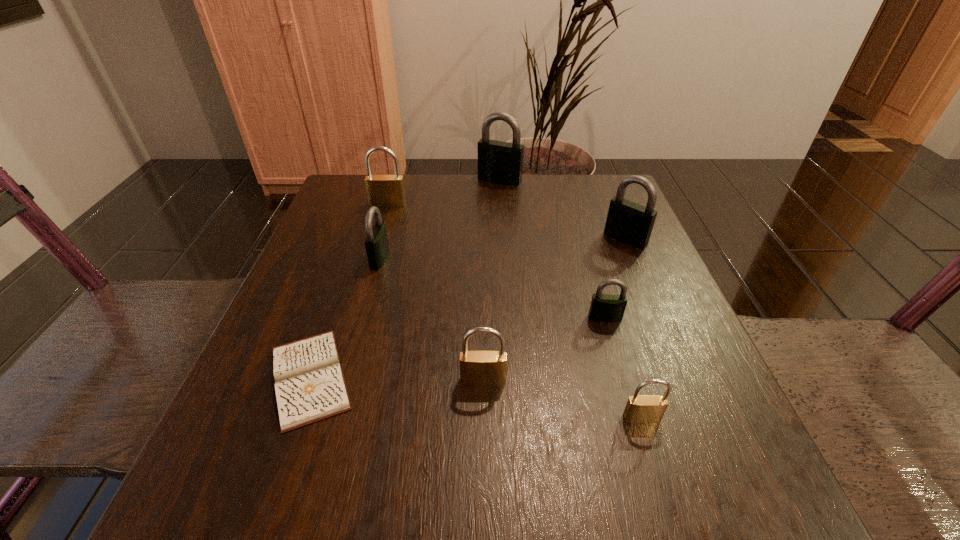
You are a GUI agent. You are given a task and a screenshot of the screen. Output one action in this format:
    pyautogui.click(x=<x>, y=<y>)
    Task: Click on the fifth farthest object
    This screenshot has height=540, width=960.
    Given the screenshot: What is the action you would take?
    pyautogui.click(x=604, y=307)

At what (x,y) coordinates should I click in order to perform the action: click on the nearest padlock. Please return your answer as a coordinate pair (x, y). The width and height of the screenshot is (960, 540). Looking at the image, I should click on (640, 408).

Image resolution: width=960 pixels, height=540 pixels. In order to click on the rightmost brass padlock in this screenshot , I will do [640, 408].

I want to click on the shortest object, so click(310, 386).

Locate an element on the screen. free space located on the front of the farthest object is located at coordinates (505, 264).

Find the location of a particular element. vacant space situated 0.220m on the front-facing side of the sixth nearest padlock is located at coordinates (370, 266).

At what (x,y) coordinates should I click in order to perform the action: click on vacant space situated 0.260m on the front of the rightmost padlock. Please return your answer as a coordinate pair (x, y). Looking at the image, I should click on (669, 343).

This screenshot has height=540, width=960. Find the location of `blank space located on the right of the leftmost black padlock`. blank space located on the right of the leftmost black padlock is located at coordinates (523, 258).

Identify the location of vacant region located on the front-facing side of the second nearest padlock. This screenshot has height=540, width=960. (484, 435).

Find the location of `vacant area located 0.320m on the left of the fourth nearest object`. vacant area located 0.320m on the left of the fourth nearest object is located at coordinates (409, 318).